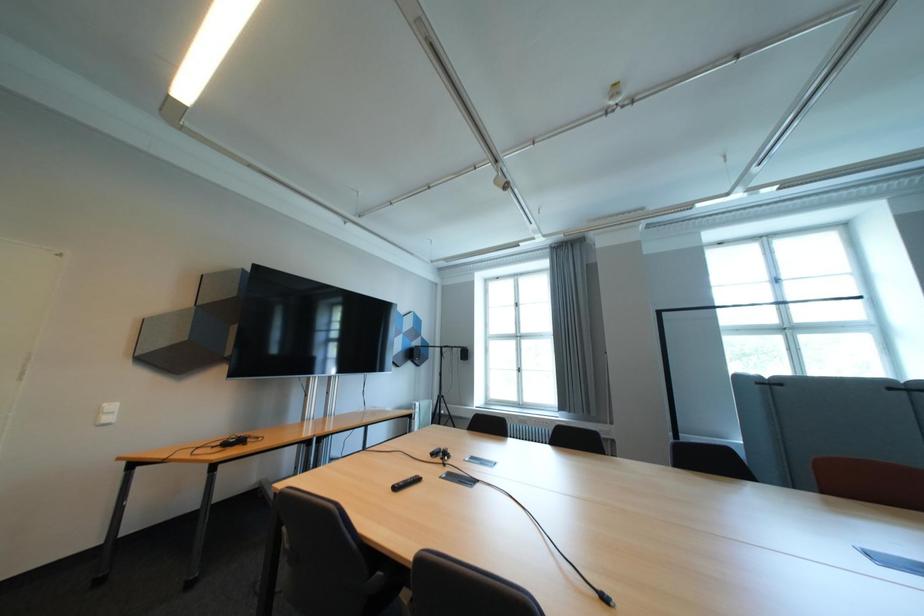
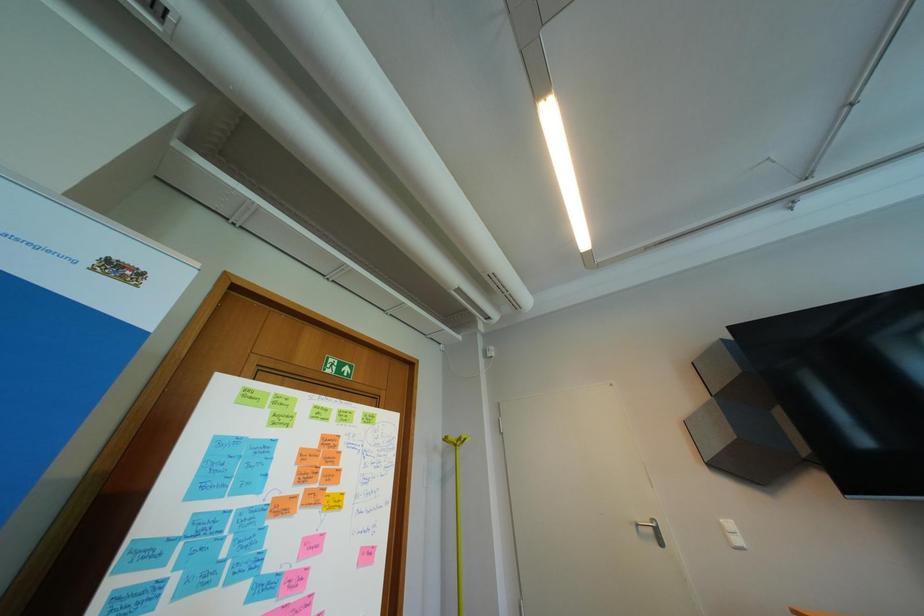
First-person continuous shooting, in which direction is the camera rotating?

The rotation direction of the camera is left-up.